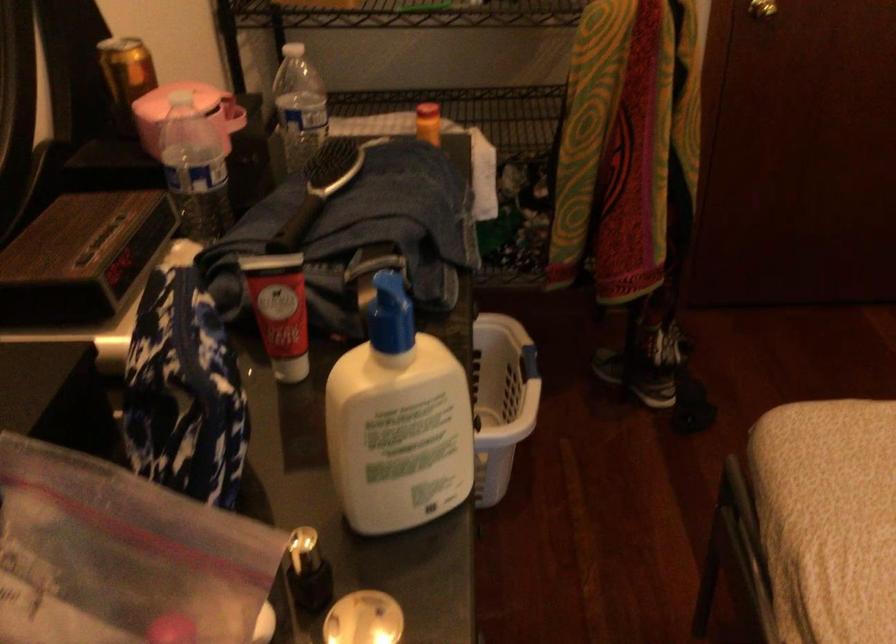
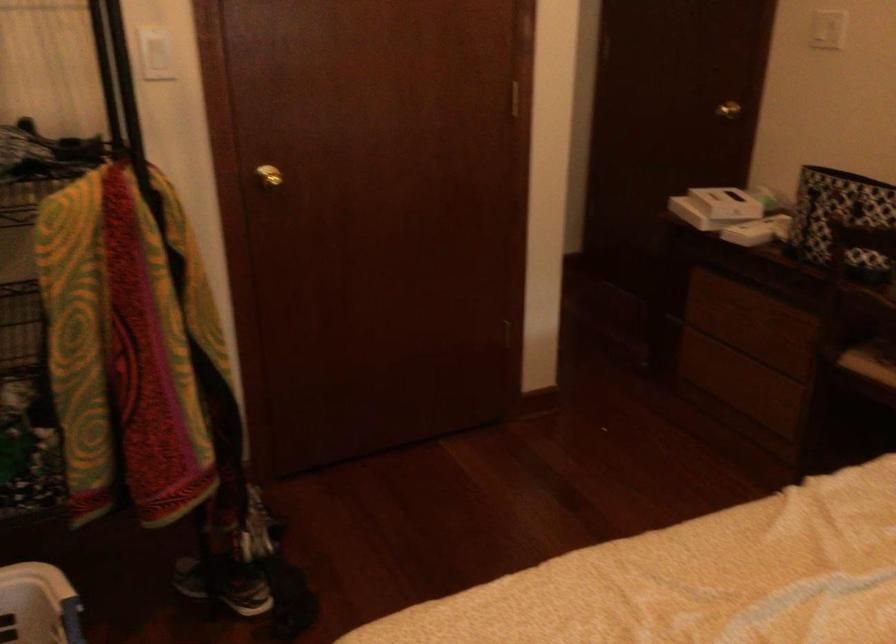
Where in the second image is the point corresponding to (x=528, y=357) from the first image?

(63, 616)